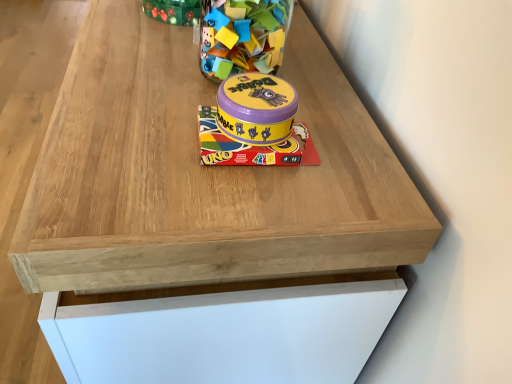
Question: Looking at their shapes, would you say matte purple tin at center, placed as the 1th toy when sorted from bottom to top, is wider or thinner than translucent plastic container at upper center, the second toy in the bottom-to-top sequence?

Choices:
 (A) wide
 (B) thin

Answer: (A)

Question: Does point (285, 87) appear closer or farther from the camera than point (281, 6)?

Choices:
 (A) farther
 (B) closer

Answer: (B)

Question: Is matte purple tin at center, the second toy in the top-to-bottom sequence, bigger or smaller than translucent plastic container at upper center, which appears as the first toy when viewed from the top?

Choices:
 (A) big
 (B) small

Answer: (B)

Question: Would you say translucent plastic container at upper center, the first toy from the back, is inside or outside matte purple tin at center, placed as the 1th toy when sorted from bottom to top?

Choices:
 (A) outside
 (B) inside

Answer: (A)

Question: Considering the positions of point (201, 18) and point (276, 104), is point (201, 18) closer or farther from the camera than point (276, 104)?

Choices:
 (A) closer
 (B) farther

Answer: (B)

Question: From the image's perspective, relative to matte purple tin at center, the 2th toy in the back-to-front sequence, is translucent plastic container at upper center, the first toy from the back, above or below?

Choices:
 (A) above
 (B) below

Answer: (A)

Question: Considering the positions of translucent plastic container at upper center, the second toy in the bottom-to-top sequence, and matte purple tin at center, which appears as the 1th toy when viewed from the front, in the image, is translucent plastic container at upper center, the second toy in the bottom-to-top sequence, wider or thinner than matte purple tin at center, which appears as the 1th toy when viewed from the front,?

Choices:
 (A) thin
 (B) wide

Answer: (A)